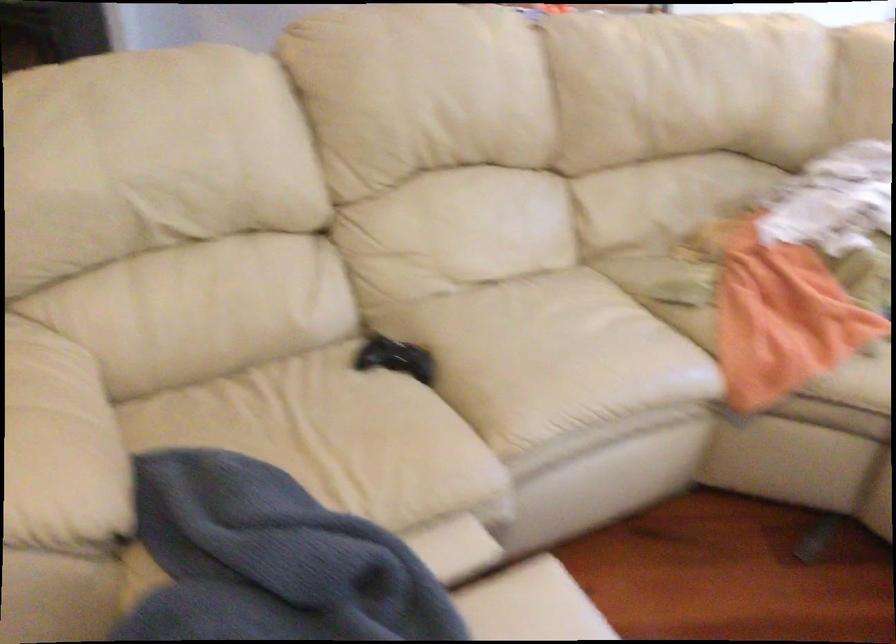
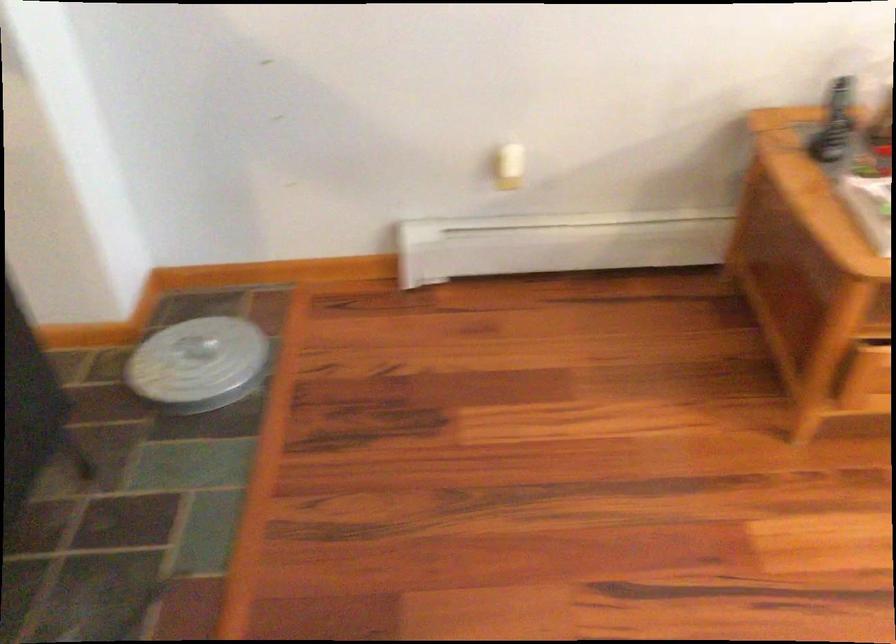
Question: In a continuous first-person perspective shot, in which direction is the camera moving?

Choices:
 (A) Left
 (B) Right
 (C) Forward
 (D) Backward

Answer: (C)